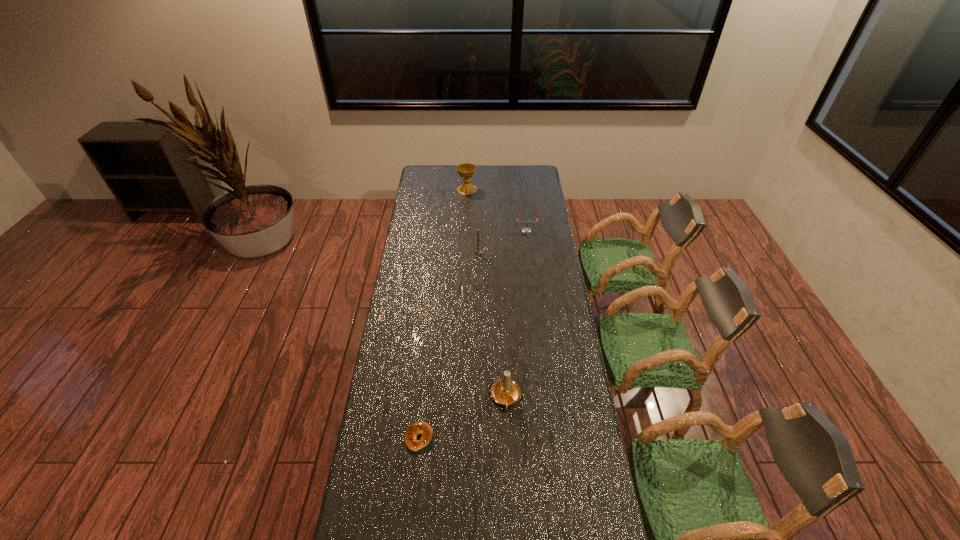
Find the location of a particular element. The height and width of the screenshot is (540, 960). empty space that is in between the leftmost candle and the chalice is located at coordinates (472, 221).

You are a GUI agent. You are given a task and a screenshot of the screen. Output one action in this format:
    pyautogui.click(x=<x>, y=<y>)
    Task: Click on the free space that is in between the second candle from right to left and the third nearest object
    
    Given the screenshot: What is the action you would take?
    pyautogui.click(x=492, y=325)

I want to click on empty location between the third nearest object and the leftmost object, so click(x=448, y=345).

Where is `free area in between the rightmost object and the second object from right to left`? free area in between the rightmost object and the second object from right to left is located at coordinates (516, 314).

The image size is (960, 540). What are the coordinates of `vacant area that lies between the rightmost object and the shortest object` in the screenshot? It's located at (472, 334).

The width and height of the screenshot is (960, 540). I want to click on free space between the nearest object and the leftmost candle, so click(448, 345).

You are a GUI agent. You are given a task and a screenshot of the screen. Output one action in this format:
    pyautogui.click(x=<x>, y=<y>)
    Task: Click on the free spot between the shortest object and the leftmost candle
    This screenshot has width=960, height=540.
    Given the screenshot: What is the action you would take?
    tap(448, 345)

This screenshot has height=540, width=960. I want to click on free area in between the third farthest object and the nearest candle, so click(x=492, y=325).

Where is `vacant area that lies between the nearest object and the second nearest object`? vacant area that lies between the nearest object and the second nearest object is located at coordinates (463, 417).

The height and width of the screenshot is (540, 960). In order to click on empty location between the leftmost object and the farthest object in this screenshot , I will do `click(443, 314)`.